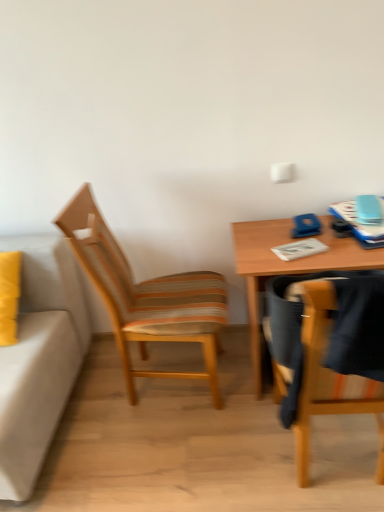
Locate an element on the screen. This screenshot has width=384, height=512. woodenchair at left, positioned as the second chair in right-to-left order is located at coordinates (146, 297).

Image resolution: width=384 pixels, height=512 pixels. Describe the element at coordinates (330, 353) in the screenshot. I see `wooden chair at right, which is the first chair from right to left` at that location.

The image size is (384, 512). Describe the element at coordinates (299, 249) in the screenshot. I see `white paper notepad at center` at that location.

Locate an element on the screen. The image size is (384, 512). woodenchair at left, which is the second chair in front-to-back order is located at coordinates (146, 297).

Which object is more forward, woodenchair at left, which is the second chair in front-to-back order, or white paper notepad at center?

→ Positioned in front is woodenchair at left, which is the second chair in front-to-back order.

From the image's perspective, between woodenchair at left, the first chair when ordered from back to front, and white paper notepad at center, which one is located above?

white paper notepad at center appears higher in the image.

Could you tell me if woodenchair at left, which is the second chair in front-to-back order, is facing white paper notepad at center?

Yes, woodenchair at left, which is the second chair in front-to-back order, is facing white paper notepad at center.

Does point (309, 391) appear closer or farther from the camera than point (130, 306)?

Point (309, 391).

How many degrees apart are the facing directions of wooden chair at right, the first chair positioned from the front, and woodenchair at left, which is the second chair in front-to-back order?

The angle between the facing direction of wooden chair at right, the first chair positioned from the front, and the facing direction of woodenchair at left, which is the second chair in front-to-back order, is 93 degrees.

Considering the relative positions of wooden chair at right, which is the 2th chair in left-to-right order, and woodenchair at left, the first chair when ordered from back to front, in the image provided, is wooden chair at right, which is the 2th chair in left-to-right order, behind woodenchair at left, the first chair when ordered from back to front,?

No, it is not.

Is wooden chair at right, arranged as the 2th chair when viewed from the back, far from woodenchair at left, which appears as the first chair when viewed from the left?

Actually, wooden chair at right, arranged as the 2th chair when viewed from the back, and woodenchair at left, which appears as the first chair when viewed from the left, are a little close together.

Is wooden table at right positioned with its back to woodenchair at left, positioned as the second chair in right-to-left order?

No, wooden table at right is not facing the opposite direction of woodenchair at left, positioned as the second chair in right-to-left order.

Considering the points (242, 230) and (193, 295), which point is behind, point (242, 230) or point (193, 295)?

The point (242, 230) is more distant.

From a real-world perspective, is wooden table at right over woodenchair at left, the first chair when ordered from back to front?

No, from a real-world perspective, wooden table at right is not over woodenchair at left, the first chair when ordered from back to front

Which is in front, point (312, 250) or point (367, 305)?

Point (367, 305)

Between white paper notepad at center and wooden chair at right, which is the first chair from right to left, which one has larger width?

wooden chair at right, which is the first chair from right to left.

Does white paper notepad at center lie in front of wooden chair at right, arranged as the 2th chair when viewed from the back?

No, white paper notepad at center is further to the viewer.

Where is `notepad above the wooden chair at right, which is the first chair from right to left (from a real-world perspective)`? notepad above the wooden chair at right, which is the first chair from right to left (from a real-world perspective) is located at coordinates (299, 249).

Between point (75, 252) and point (327, 269), which one is positioned in front?

The point (327, 269) is closer.

Is woodenchair at left, the first chair when ordered from back to front, outside of wooden table at right?

Yes, woodenchair at left, the first chair when ordered from back to front, is not within wooden table at right.

Is woodenchair at left, positioned as the second chair in right-to-left order, wider than wooden table at right?

Indeed, woodenchair at left, positioned as the second chair in right-to-left order, has a greater width compared to wooden table at right.

Can you confirm if white paper notepad at center is thinner than woodenchair at left, which appears as the first chair when viewed from the left?

Indeed, white paper notepad at center has a lesser width compared to woodenchair at left, which appears as the first chair when viewed from the left.

Considering the positions of points (321, 244) and (185, 286), is point (321, 244) farther from camera compared to point (185, 286)?

No, it is in front of (185, 286).

Considering the sizes of objects white paper notepad at center and woodenchair at left, positioned as the second chair in right-to-left order, in the image provided, who is shorter, white paper notepad at center or woodenchair at left, positioned as the second chair in right-to-left order,?

With less height is white paper notepad at center.

Does white paper notepad at center appear on the left side of woodenchair at left, the first chair when ordered from back to front?

In fact, white paper notepad at center is to the right of woodenchair at left, the first chair when ordered from back to front.

Is wooden chair at right, arranged as the 2th chair when viewed from the back, oriented away from wooden table at right?

wooden chair at right, arranged as the 2th chair when viewed from the back, does not have its back to wooden table at right.

Is wooden chair at right, arranged as the 2th chair when viewed from the back, bigger than wooden table at right?

Actually, wooden chair at right, arranged as the 2th chair when viewed from the back, might be smaller than wooden table at right.

Who is more distant, wooden chair at right, which is the 2th chair in left-to-right order, or wooden table at right?

wooden table at right is behind.

What's the angular difference between wooden chair at right, the first chair positioned from the front, and wooden table at right's facing directions?

The facing directions of wooden chair at right, the first chair positioned from the front, and wooden table at right are 179 degrees apart.

In order to click on notepad that is above the woodenchair at left, which appears as the first chair when viewed from the left (from the image's perspective) in this screenshot , I will do `click(299, 249)`.

The image size is (384, 512). I want to click on chair below the woodenchair at left, which is the second chair in front-to-back order (from the image's perspective), so click(330, 353).

Considering their positions, is white paper notepad at center positioned further to wooden chair at right, which is the 2th chair in left-to-right order, than wooden table at right?

white paper notepad at center.

When comparing their distances from woodenchair at left, which appears as the first chair when viewed from the left, does wooden table at right or white paper notepad at center seem closer?

wooden table at right is positioned closer to the anchor woodenchair at left, which appears as the first chair when viewed from the left.

When comparing their distances from wooden chair at right, which is the 2th chair in left-to-right order, does woodenchair at left, the first chair when ordered from back to front, or white paper notepad at center seem further?

woodenchair at left, the first chair when ordered from back to front, is further to wooden chair at right, which is the 2th chair in left-to-right order.

From the image, which object appears to be farther from wooden chair at right, arranged as the 2th chair when viewed from the back, wooden table at right or white paper notepad at center?

white paper notepad at center is further to wooden chair at right, arranged as the 2th chair when viewed from the back.

Estimate the real-world distances between objects in this image. Which object is further from wooden chair at right, arranged as the 2th chair when viewed from the back, white paper notepad at center or woodenchair at left, which is the second chair in front-to-back order?

Based on the image, woodenchair at left, which is the second chair in front-to-back order, appears to be further to wooden chair at right, arranged as the 2th chair when viewed from the back.

Estimate the real-world distances between objects in this image. Which object is closer to white paper notepad at center, wooden chair at right, which is the first chair from right to left, or woodenchair at left, which is the second chair in front-to-back order?

wooden chair at right, which is the first chair from right to left.

Based on their spatial positions, is woodenchair at left, positioned as the second chair in right-to-left order, or wooden table at right closer to white paper notepad at center?

wooden table at right.

Estimate the real-world distances between objects in this image. Which object is further from white paper notepad at center, woodenchair at left, which appears as the first chair when viewed from the left, or wooden chair at right, which is the 2th chair in left-to-right order?

woodenchair at left, which appears as the first chair when viewed from the left, is further to white paper notepad at center.

Identify the location of chair between wooden chair at right, which is the 2th chair in left-to-right order, and white paper notepad at center, along the z-axis. (146, 297).

At what (x,y) coordinates should I click in order to perform the action: click on chair between woodenchair at left, which is the second chair in front-to-back order, and wooden table at right, in the horizontal direction. Please return your answer as a coordinate pair (x, y). Image resolution: width=384 pixels, height=512 pixels. Looking at the image, I should click on (330, 353).

Locate an element on the screen. desk between wooden chair at right, arranged as the 2th chair when viewed from the back, and white paper notepad at center in the front-back direction is located at coordinates (288, 265).

Image resolution: width=384 pixels, height=512 pixels. Identify the location of notepad between woodenchair at left, positioned as the second chair in right-to-left order, and wooden table at right, in the horizontal direction. (299, 249).